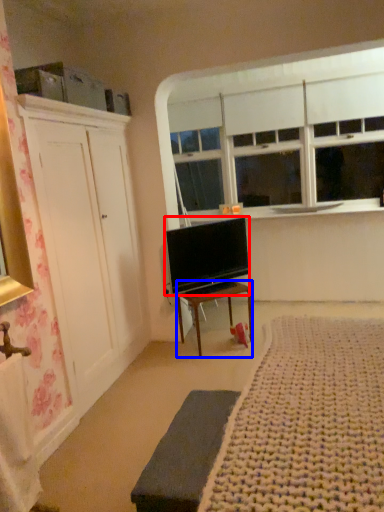
Question: Among these objects, which one is nearest to the camera, television (highlighted by a red box) or desk (highlighted by a blue box)?

Choices:
 (A) television
 (B) desk

Answer: (A)